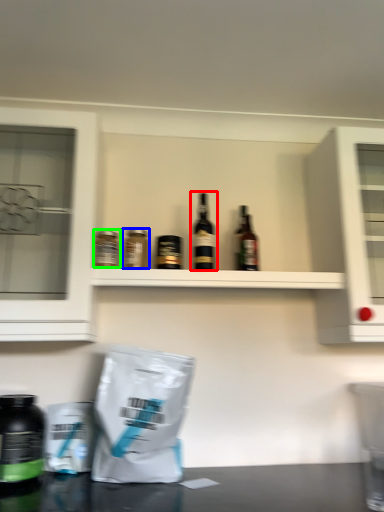
Question: Which is farther away from bottle (highlighted by a red box)? bottle (highlighted by a blue box) or bottle (highlighted by a green box)?

Choices:
 (A) bottle
 (B) bottle

Answer: (B)